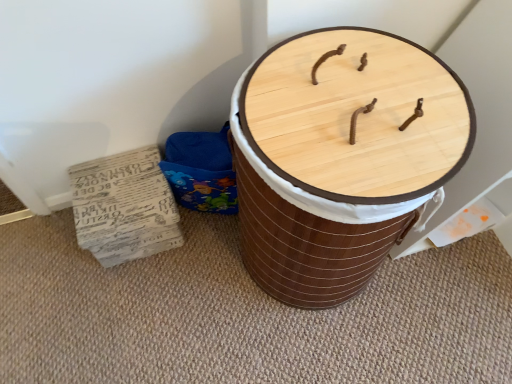
The image size is (512, 384). In order to click on spots to the right of recycled paper stack at lower left in this screenshot , I will do `click(215, 262)`.